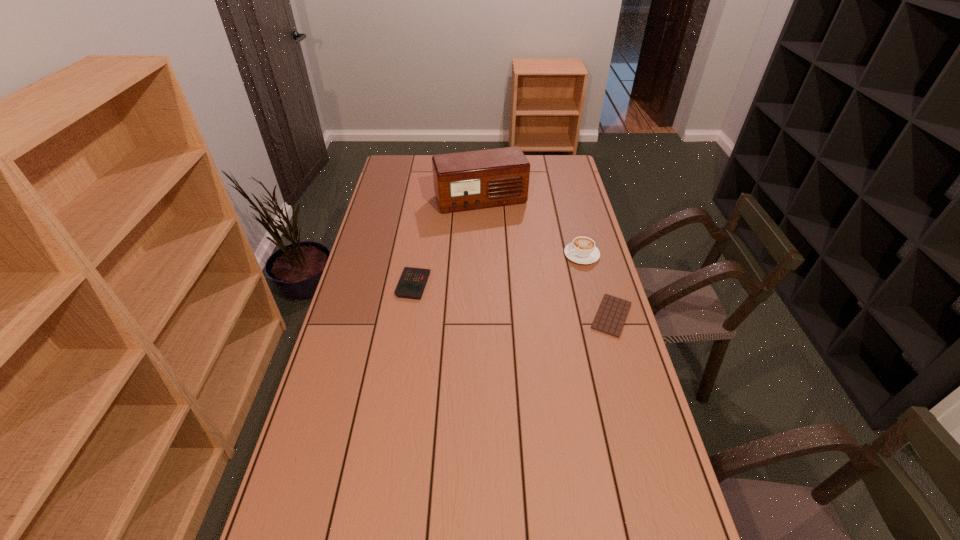
The width and height of the screenshot is (960, 540). In order to click on free space on the desktop that is between the calculator and the chocolate bar and is positioned on the side of the second tallest object with the handle in this screenshot , I will do `click(480, 295)`.

Where is `free space on the desktop that is between the second shortest object and the shortest object and is positioned on the front-facing side of the tallest object`? This screenshot has height=540, width=960. free space on the desktop that is between the second shortest object and the shortest object and is positioned on the front-facing side of the tallest object is located at coordinates (522, 302).